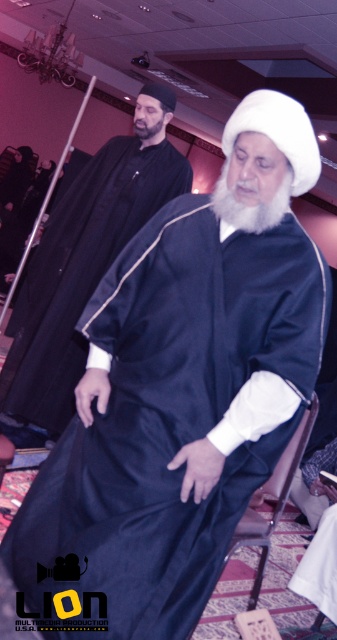
Measure the distance between satin black robe at center and matte black robe at center.

satin black robe at center is 1.15 meters away from matte black robe at center.

Which is behind, point (152, 298) or point (64, 397)?

Point (64, 397)

Who is more forward, (111, 323) or (83, 259)?

Point (111, 323) is more forward.

Find the location of a particular element. The height and width of the screenshot is (640, 337). satin black robe at center is located at coordinates (167, 422).

Does matte black robe at center lie behind white soft beard at center?

Yes, it is behind white soft beard at center.

Is matte black robe at center positioned in front of white soft beard at center?

No.

Which is behind, point (76, 355) or point (278, 193)?

The point (76, 355) is more distant.

Locate an element on the screen. matte black robe at center is located at coordinates (79, 273).

How far apart are satin black robe at center and brown leather chair at lower center?

The distance of satin black robe at center from brown leather chair at lower center is 19.01 inches.

Looking at this image, is satin black robe at center to the left of brown leather chair at lower center from the viewer's perspective?

Correct, you'll find satin black robe at center to the left of brown leather chair at lower center.

Where is `satin black robe at center`? The height and width of the screenshot is (640, 337). satin black robe at center is located at coordinates (167, 422).